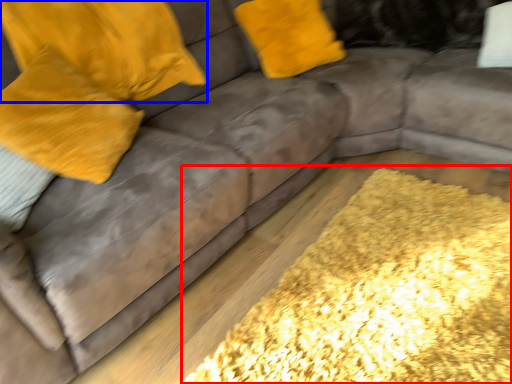
Question: Which object appears closest to the camera in this image, mat (highlighted by a red box) or pillow (highlighted by a blue box)?

Choices:
 (A) mat
 (B) pillow

Answer: (A)